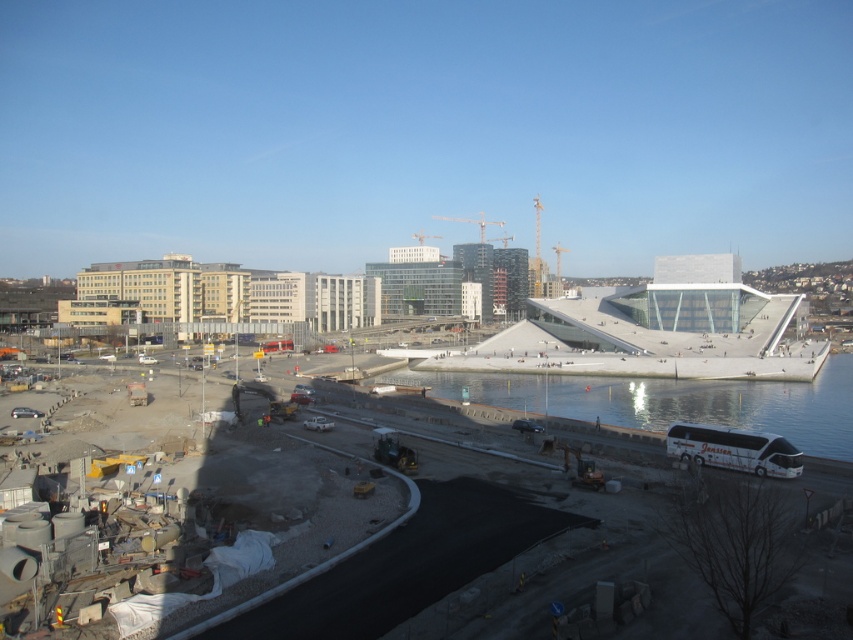
You are a construction worker who needs to cross from the concrete construction site at lower left to the clear glass waterway at lower center. Is the path between them accessible?

The clear glass waterway at lower center is above the concrete construction site at lower left, so there is no direct accessible path between them. You would need to find an alternative route around the construction site or use a bridge or staircase if available.

You are a crane operator at the construction site near the Oslo Opera House. You need to lower a heavy beam to the clear glass waterway at lower center. The crane can reach up to 200 feet. Is the distance within the crane operator reach?

The clear glass waterway at lower center is 195.92 feet from viewer. Since the crane can reach up to 200 feet, the distance is within the crane operator reach.

You are a construction worker standing at the edge of the construction zone near the white bus labeled Jenssen. You need to cross to the Oslo Opera House. Is the clear glass waterway at lower center between your current position and the Opera House?

The clear glass waterway at lower center is located at point (670,401). Since the bus is near the edge of the construction zone and the Opera House is in the midground, the waterway is likely between them. Therefore, you would need to cross the clear glass waterway at lower center to reach the Opera House.